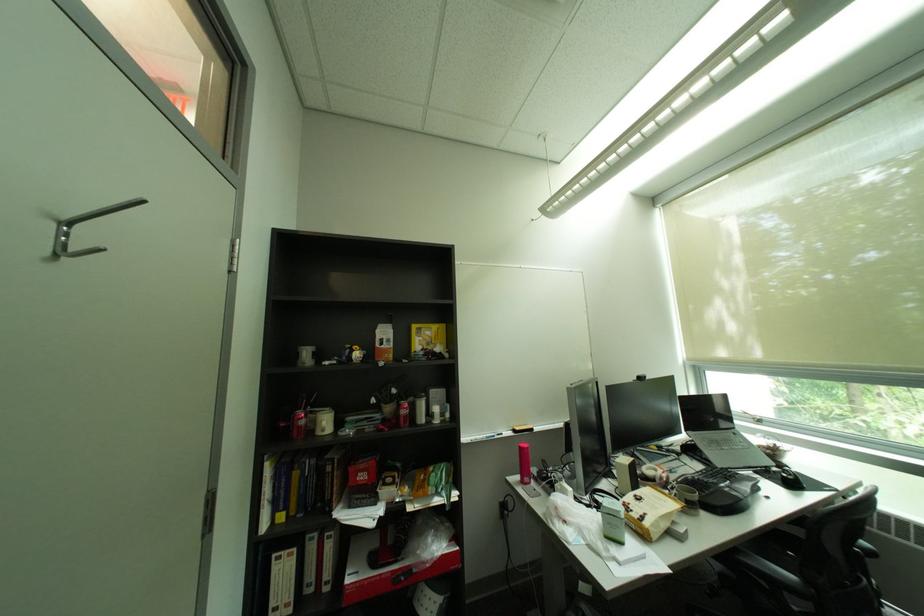
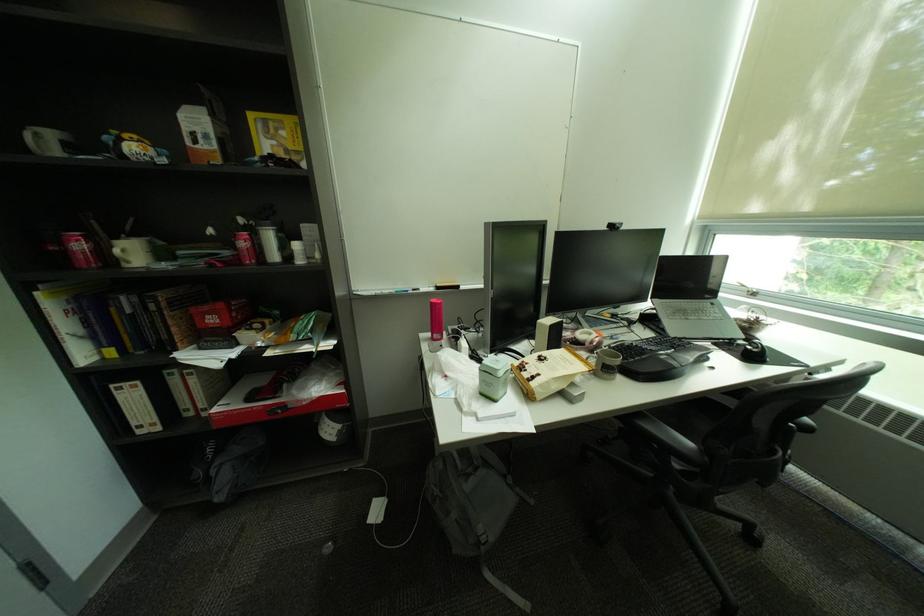
Find the pixel in the second image that matches (334,424) in the first image.

(128, 252)